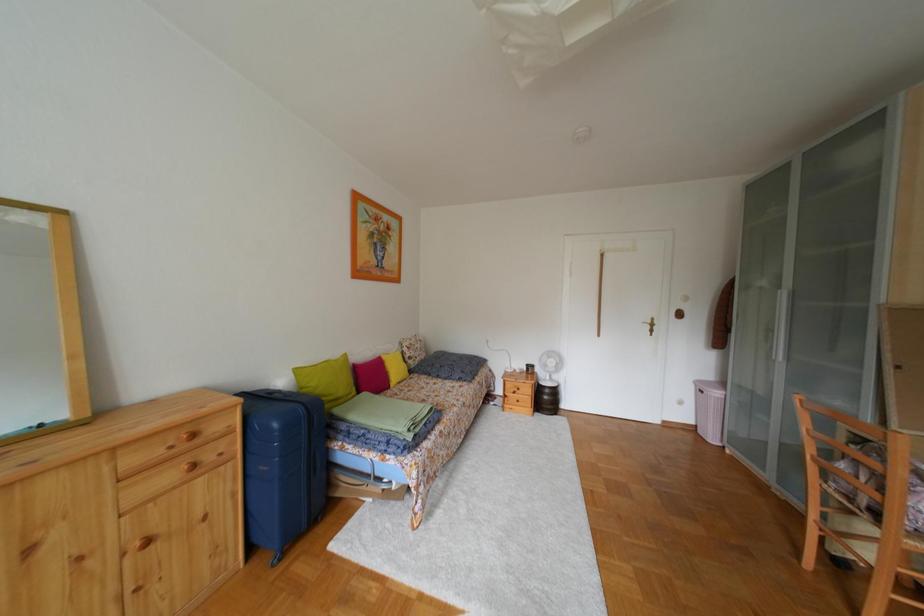
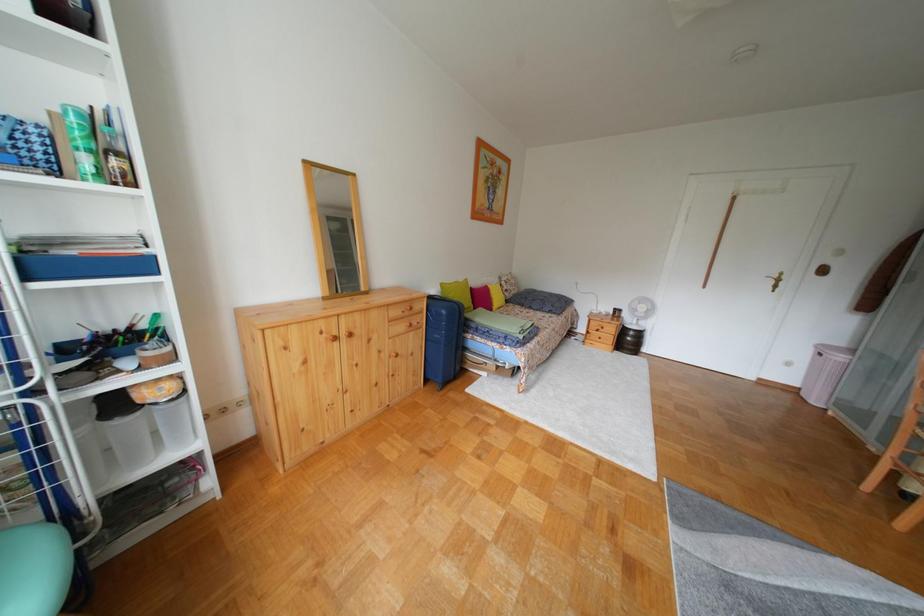
Question: The camera is either moving clockwise (left) or counter-clockwise (right) around the object. The first image is from the beginning of the video and the second image is from the end. Is the camera moving left or right when shooting the video?

Choices:
 (A) Left
 (B) Right

Answer: (B)